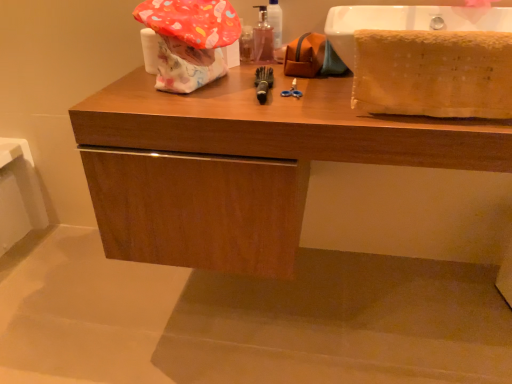
Where is `vacant space situated on the left part of black rubber toothbrush at center`? vacant space situated on the left part of black rubber toothbrush at center is located at coordinates (198, 96).